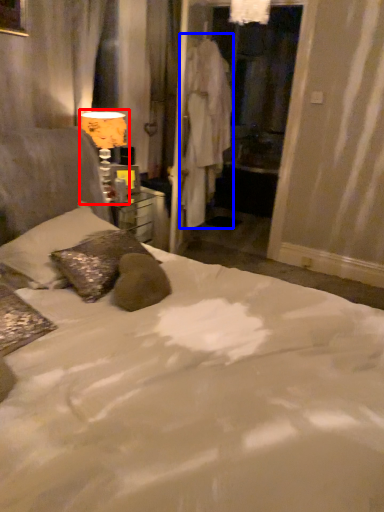
Question: Which of the following is the farthest to the observer, table lamp (highlighted by a red box) or robe (highlighted by a blue box)?

Choices:
 (A) table lamp
 (B) robe

Answer: (B)